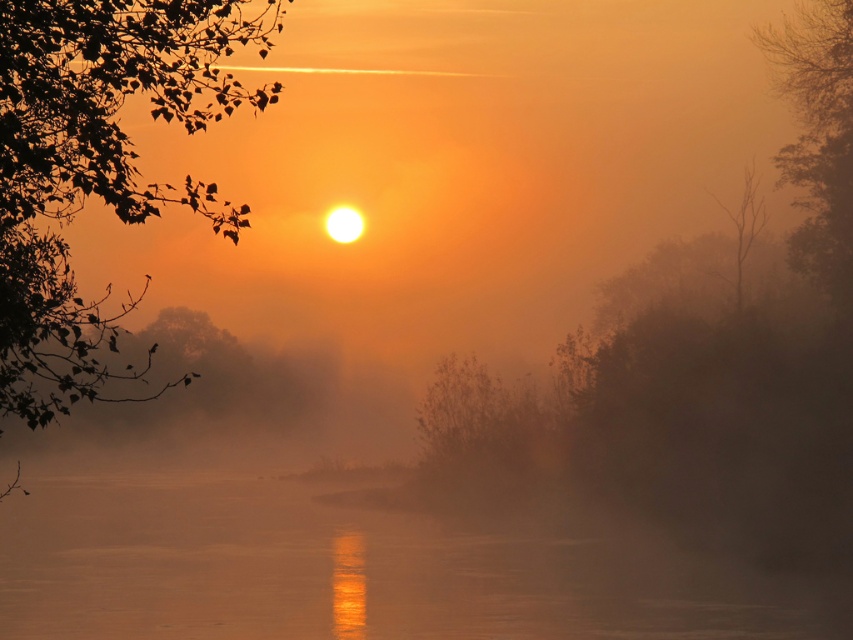
Question: Which point is closer to the camera taking this photo?

Choices:
 (A) (838, 228)
 (B) (56, 156)

Answer: (B)

Question: Which is farther from the green leafy tree at upper left?

Choices:
 (A) green matte tree at upper right
 (B) smooth water at center
 (C) brown fuzzy bush at center

Answer: (A)

Question: Which of the following is the closest to the observer?

Choices:
 (A) green leafy tree at upper left
 (B) brown fuzzy bush at center
 (C) green matte tree at upper right

Answer: (A)

Question: Does green matte tree at upper right appear over brown fuzzy bush at center?

Choices:
 (A) yes
 (B) no

Answer: (A)

Question: Can you confirm if smooth water at center is wider than green leafy tree at upper left?

Choices:
 (A) no
 (B) yes

Answer: (B)

Question: Does smooth water at center appear over brown fuzzy bush at center?

Choices:
 (A) yes
 (B) no

Answer: (B)